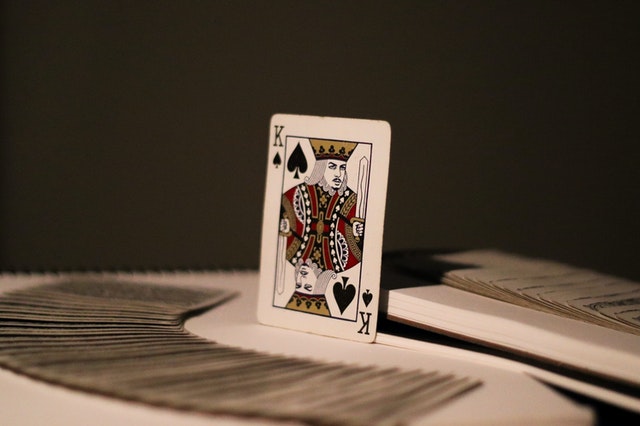
You are a GUI agent. You are given a task and a screenshot of the screen. Output one action in this format:
    pyautogui.click(x=<x>, y=<y>)
    Task: Click on the white table
    
    Given the screenshot: What is the action you would take?
    pyautogui.click(x=548, y=328), pyautogui.click(x=513, y=403)